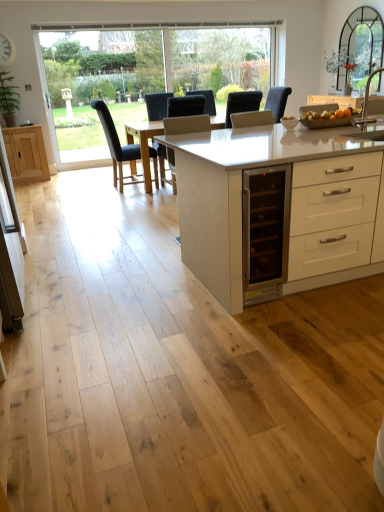
Question: From the image's perspective, is white glossy table at center under dark gray fabric chair at center, which is the first chair in right-to-left order?

Choices:
 (A) no
 (B) yes

Answer: (B)

Question: Is white glossy table at center located outside dark gray fabric chair at center, which is the first chair in right-to-left order?

Choices:
 (A) no
 (B) yes

Answer: (B)

Question: Is white glossy table at center facing towards dark gray fabric chair at center, which is the 2th chair in left-to-right order?

Choices:
 (A) yes
 (B) no

Answer: (A)

Question: Considering the relative sizes of white glossy table at center and dark gray fabric chair at center, which is the 2th chair in left-to-right order, in the image provided, is white glossy table at center thinner than dark gray fabric chair at center, which is the 2th chair in left-to-right order,?

Choices:
 (A) no
 (B) yes

Answer: (A)

Question: Is white glossy table at center placed right next to dark gray fabric chair at center, which is the 2th chair in left-to-right order?

Choices:
 (A) yes
 (B) no

Answer: (B)

Question: Is white glossy table at center wider than dark gray fabric chair at center, which is the 2th chair in left-to-right order?

Choices:
 (A) yes
 (B) no

Answer: (A)

Question: Is dark gray fabric chair at center, which is the 2th chair in left-to-right order, positioned behind white glossy table at center?

Choices:
 (A) yes
 (B) no

Answer: (A)

Question: Is dark gray fabric chair at center, which is the first chair in right-to-left order, taller than white glossy table at center?

Choices:
 (A) no
 (B) yes

Answer: (B)

Question: Is dark gray fabric chair at center, which is the 2th chair in left-to-right order, facing away from white glossy table at center?

Choices:
 (A) yes
 (B) no

Answer: (A)

Question: Can you confirm if dark gray fabric chair at center, which is the first chair in right-to-left order, is wider than white glossy table at center?

Choices:
 (A) no
 (B) yes

Answer: (A)

Question: From a real-world perspective, is dark gray fabric chair at center, which is the first chair in right-to-left order, on top of white glossy table at center?

Choices:
 (A) yes
 (B) no

Answer: (A)

Question: Is dark gray fabric chair at center, which is the first chair in right-to-left order, at the left side of white glossy table at center?

Choices:
 (A) yes
 (B) no

Answer: (A)

Question: Is black leather chair at center, placed as the second chair when sorted from right to left, taller than white glossy table at center?

Choices:
 (A) no
 (B) yes

Answer: (B)